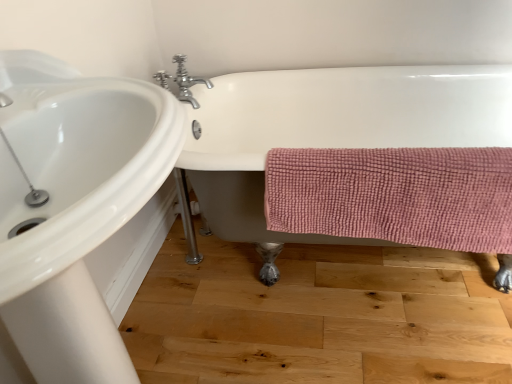
Question: From a real-world perspective, is white glossy bathtub at center over chrome metallic faucet at upper center?

Choices:
 (A) yes
 (B) no

Answer: (B)

Question: Is white glossy bathtub at center behind chrome metallic faucet at upper center?

Choices:
 (A) no
 (B) yes

Answer: (A)

Question: Can chrome metallic faucet at upper center be found inside white glossy bathtub at center?

Choices:
 (A) yes
 (B) no

Answer: (B)

Question: Is white glossy bathtub at center not near chrome metallic faucet at upper center?

Choices:
 (A) yes
 (B) no

Answer: (B)

Question: From the image's perspective, is white glossy bathtub at center over chrome metallic faucet at upper center?

Choices:
 (A) no
 (B) yes

Answer: (A)

Question: Which is correct: pink textured towel at lower right is inside white glossy sink at upper left, or outside of it?

Choices:
 (A) inside
 (B) outside

Answer: (B)

Question: Is pink textured towel at lower right taller or shorter than white glossy sink at upper left?

Choices:
 (A) short
 (B) tall

Answer: (A)

Question: From a real-world perspective, relative to white glossy sink at upper left, is pink textured towel at lower right vertically above or below?

Choices:
 (A) below
 (B) above

Answer: (A)

Question: From the image's perspective, relative to white glossy sink at upper left, is pink textured towel at lower right above or below?

Choices:
 (A) above
 (B) below

Answer: (A)

Question: Considering their positions, is chrome metallic faucet at upper center located in front of or behind pink textured towel at lower right?

Choices:
 (A) front
 (B) behind

Answer: (B)

Question: Is chrome metallic faucet at upper center taller or shorter than pink textured towel at lower right?

Choices:
 (A) short
 (B) tall

Answer: (A)

Question: Considering the positions of chrome metallic faucet at upper center and pink textured towel at lower right in the image, is chrome metallic faucet at upper center wider or thinner than pink textured towel at lower right?

Choices:
 (A) thin
 (B) wide

Answer: (B)

Question: Is point (180, 97) positioned closer to the camera than point (276, 162)?

Choices:
 (A) closer
 (B) farther

Answer: (B)

Question: Is point (428, 139) positioned closer to the camera than point (420, 173)?

Choices:
 (A) closer
 (B) farther

Answer: (B)

Question: Looking at the image, does white glossy bathtub at center seem bigger or smaller compared to pink textured towel at lower right?

Choices:
 (A) big
 (B) small

Answer: (A)